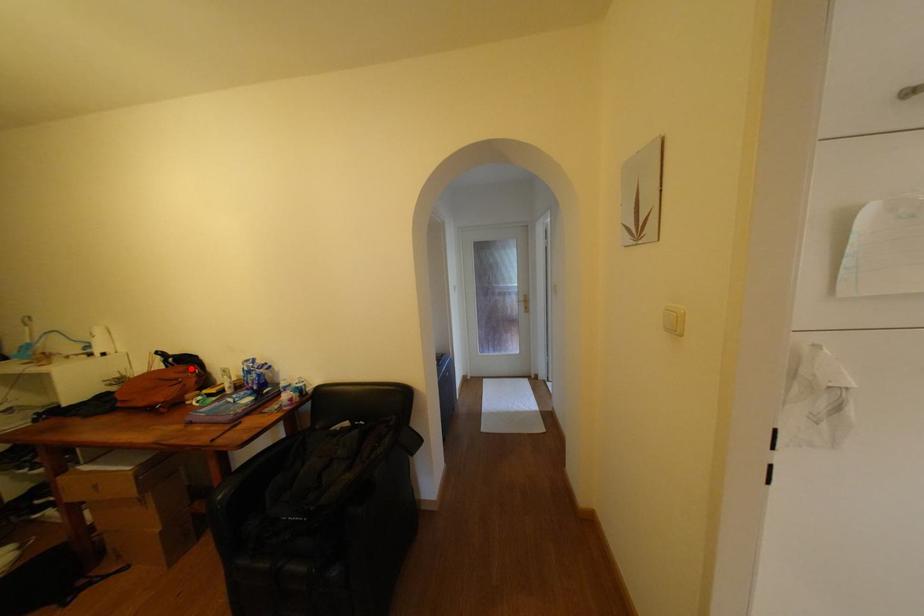
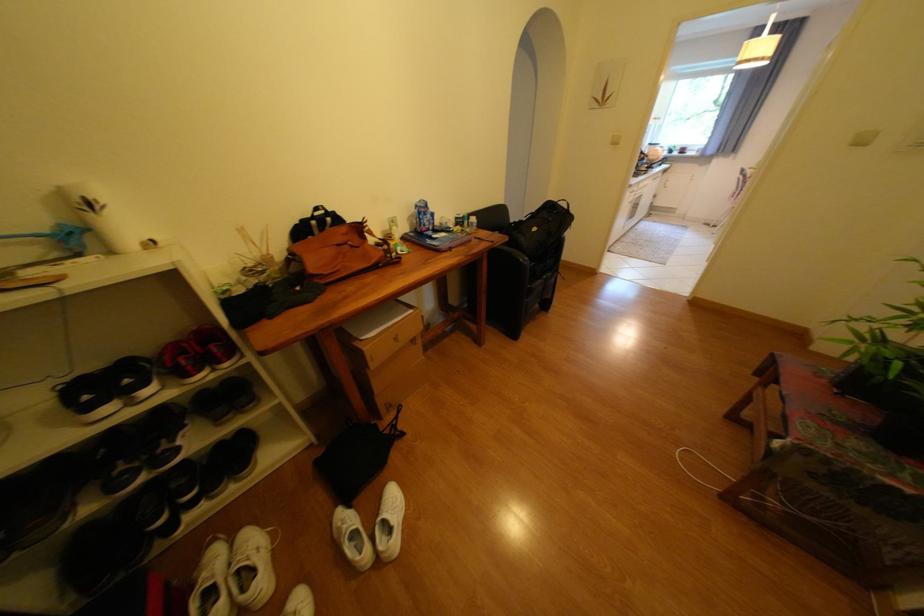
Question: I am providing you with two images of the same scene from different viewpoints. In image1, a red point is highlighted. Considering the same 3D point in image2, which of the following is correct?

Choices:
 (A) It is closer
 (B) It is farther

Answer: (A)